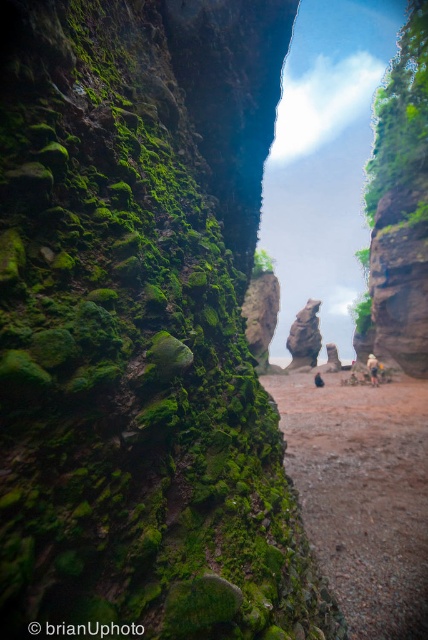
Is green mossy rock at upper right positioned behind blue fabric person at center?

No, it is not.

Does green mossy rock at upper right have a greater height compared to blue fabric person at center?

Yes, green mossy rock at upper right is taller than blue fabric person at center.

Locate an element on the screen. green mossy rock at upper right is located at coordinates (401, 115).

This screenshot has width=428, height=640. I want to click on green mossy rock at upper right, so click(401, 115).

Between green mossy rock at upper right and rusty stone rock at center, which one appears on the right side from the viewer's perspective?

Positioned to the right is green mossy rock at upper right.

Is green mossy rock at upper right wider than rusty stone rock at center?

Indeed, green mossy rock at upper right has a greater width compared to rusty stone rock at center.

Locate an element on the screen. The image size is (428, 640). green mossy rock at upper right is located at coordinates tap(401, 115).

Where is `green mossy rock at upper right`? Image resolution: width=428 pixels, height=640 pixels. green mossy rock at upper right is located at coordinates (401, 115).

Looking at this image, is rusty stone rock at center below camouflage fabric backpack at center?

No, rusty stone rock at center is not below camouflage fabric backpack at center.

Is rusty stone rock at center taller than camouflage fabric backpack at center?

Yes, rusty stone rock at center is taller than camouflage fabric backpack at center.

Is point (293, 349) closer to camera compared to point (372, 372)?

No, (293, 349) is behind (372, 372).

You are a GUI agent. You are given a task and a screenshot of the screen. Output one action in this format:
    pyautogui.click(x=<x>, y=<y>)
    Task: Click on the rusty stone rock at center
    
    Given the screenshot: What is the action you would take?
    pyautogui.click(x=305, y=337)